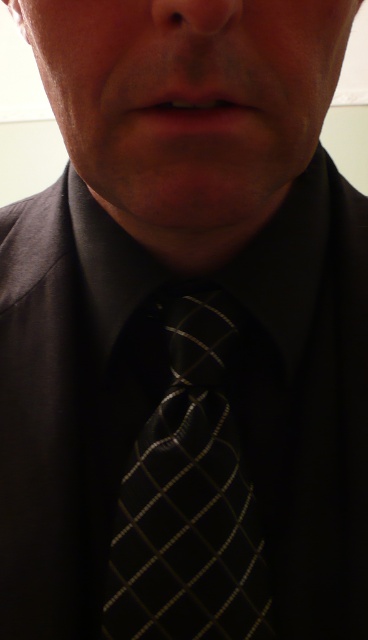
You are a photographer trying to capture a close portrait of a person. You are currently positioned at the point marked as point [204,481]. If the camera is 13.57 inches away from this point, will you be able to fit the entire tie and collar into the frame?

The camera is 13.57 inches away from point [204,481]. Since the tie and collar are part of the person wearing formal attire with a neatly knotted tie, the distance should allow capturing the entire tie and collar in the frame.

You are a photographer adjusting your camera settings to focus on the black textured tie at center. What are the coordinates you should input into the camera to ensure the tie is centered in the frame?

The coordinates for the black textured tie at center are at point (189, 496), so inputting these values will center the tie in the frame.